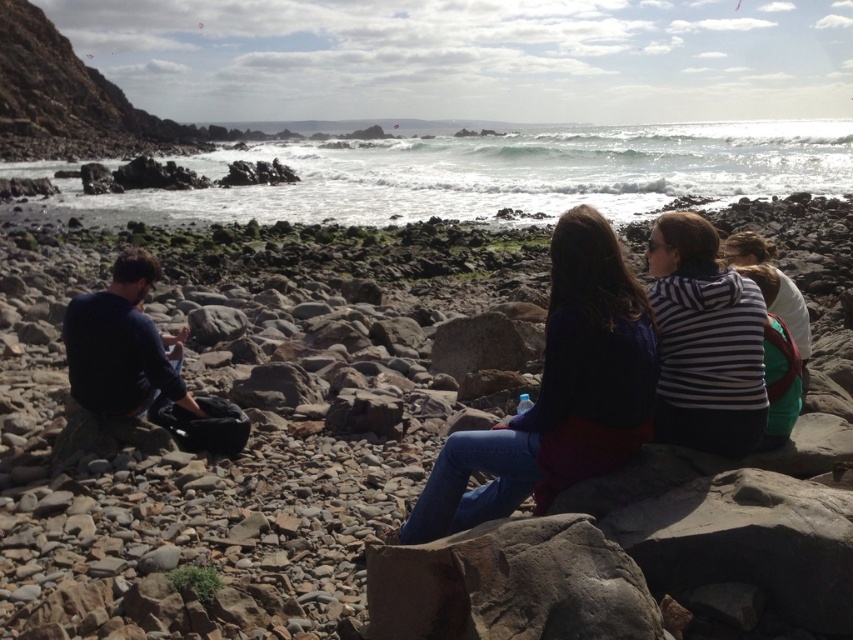
Does point (637, 330) come behind point (68, 356)?

No, it is not.

Is dark blue sweater at center shorter than dark blue sweater at left?

No.

Is point (502, 454) farther from viewer compared to point (144, 358)?

No, it is not.

Identify the location of dark blue sweater at center. The image size is (853, 640). (558, 394).

You are a GUI agent. You are given a task and a screenshot of the screen. Output one action in this format:
    pyautogui.click(x=<x>, y=<y>)
    Task: Click on the striped fabric hoodie at center right
    Image resolution: width=853 pixels, height=640 pixels.
    Given the screenshot: What is the action you would take?
    pyautogui.click(x=704, y=340)

Between point (704, 316) and point (798, 348), which one is positioned behind?

The point (798, 348) is behind.

Is point (755, 368) farther from camera compared to point (766, 268)?

No, it is in front of (766, 268).

This screenshot has width=853, height=640. Identify the location of striped fabric hoodie at center right. (704, 340).

Is dark blue sweater at center taller than striped fabric hoodie at center right?

Correct, dark blue sweater at center is much taller as striped fabric hoodie at center right.

Can you confirm if dark blue sweater at center is wider than striped fabric hoodie at center right?

Yes, dark blue sweater at center is wider than striped fabric hoodie at center right.

Who is more distant from viewer, (641, 330) or (700, 362)?

The point (700, 362) is more distant.

What are the coordinates of `dark blue sweater at center` in the screenshot? It's located at (558, 394).